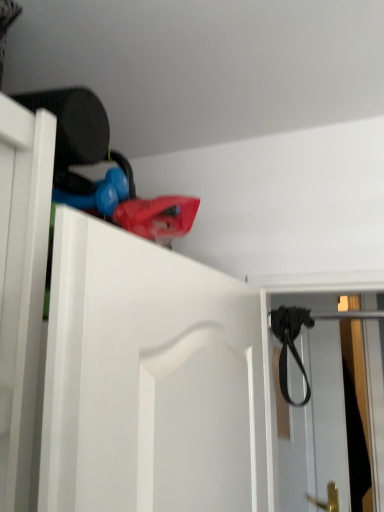
Question: Looking at the image, does black rubber strap at upper right seem bigger or smaller compared to black leather strap at upper right?

Choices:
 (A) small
 (B) big

Answer: (B)

Question: From the image's perspective, is black rubber strap at upper right above or below black leather strap at upper right?

Choices:
 (A) below
 (B) above

Answer: (A)

Question: From a real-world perspective, is black rubber strap at upper right physically located above or below black leather strap at upper right?

Choices:
 (A) below
 (B) above

Answer: (A)

Question: From the image's perspective, relative to black rubber strap at upper right, is black leather strap at upper right above or below?

Choices:
 (A) above
 (B) below

Answer: (A)

Question: Choose the correct answer: Is black leather strap at upper right inside black rubber strap at upper right or outside it?

Choices:
 (A) inside
 (B) outside

Answer: (B)

Question: Is black leather strap at upper right bigger or smaller than black rubber strap at upper right?

Choices:
 (A) small
 (B) big

Answer: (A)

Question: Considering the positions of black leather strap at upper right and black rubber strap at upper right in the image, is black leather strap at upper right taller or shorter than black rubber strap at upper right?

Choices:
 (A) tall
 (B) short

Answer: (B)